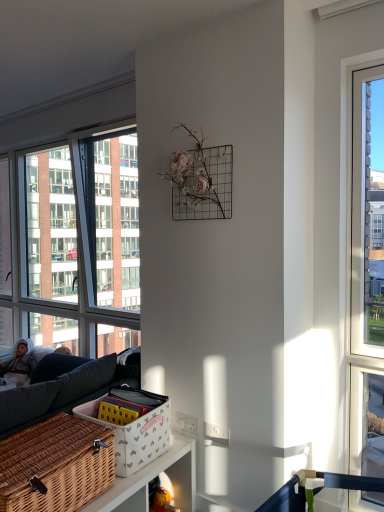
Locate an element on the screen. The image size is (384, 512). white wicker basket at lower center is located at coordinates (135, 431).

Describe the element at coordinates (135, 431) in the screenshot. I see `white wicker basket at lower center` at that location.

Measure the distance between point (66, 472) and camera.

1.56 meters.

Locate an element on the screen. This screenshot has width=384, height=512. white wicker basket at lower center is located at coordinates (135, 431).

Based on the photo, considering the sizes of objects clear glass window at left and fluffy white doll at left in the image provided, who is shorter, clear glass window at left or fluffy white doll at left?

fluffy white doll at left.

How different are the orientations of clear glass window at left and fluffy white doll at left in degrees?

The facing directions of clear glass window at left and fluffy white doll at left are 3.87 degrees apart.

Between clear glass window at left and fluffy white doll at left, which one has smaller size?

fluffy white doll at left is smaller.

Is clear glass window at left facing towards fluffy white doll at left?

Yes.

Does woven brown picnic basket at lower left have a greater height compared to clear glass window at left?

No, woven brown picnic basket at lower left is not taller than clear glass window at left.

Between woven brown picnic basket at lower left and clear glass window at left, which one has larger width?

woven brown picnic basket at lower left.

Could you tell me if white wicker basket at lower center is turned towards clear glass window at left?

No, white wicker basket at lower center is not turned towards clear glass window at left.

Visually, is white wicker basket at lower center positioned to the left or to the right of clear glass window at left?

From the image, it's evident that white wicker basket at lower center is to the right of clear glass window at left.

Which of these two, white wicker basket at lower center or clear glass window at left, stands taller?

With more height is clear glass window at left.

Is clear glass window at left located within white wicker basket at lower center?

No, clear glass window at left is located outside of white wicker basket at lower center.

Considering the sizes of woven brown picnic basket at lower left and fluffy white doll at left in the image, is woven brown picnic basket at lower left taller or shorter than fluffy white doll at left?

Clearly, woven brown picnic basket at lower left is shorter compared to fluffy white doll at left.

Considering the sizes of objects woven brown picnic basket at lower left and fluffy white doll at left in the image provided, who is bigger, woven brown picnic basket at lower left or fluffy white doll at left?

Bigger between the two is woven brown picnic basket at lower left.

From the image's perspective, is woven brown picnic basket at lower left under fluffy white doll at left?

Yes, from the image's perspective, woven brown picnic basket at lower left is below fluffy white doll at left.

What's the angular difference between woven brown picnic basket at lower left and fluffy white doll at left's facing directions?

92 degrees separate the facing orientations of woven brown picnic basket at lower left and fluffy white doll at left.

Consider the image. Is there a large distance between white wicker basket at lower center and fluffy white doll at left?

Yes, white wicker basket at lower center and fluffy white doll at left are quite far apart.

Does point (96, 419) come behind point (0, 385)?

No, (96, 419) is in front of (0, 385).

What's the angular difference between white wicker basket at lower center and fluffy white doll at left's facing directions?

91.9 degrees.

Considering the sizes of objects white wicker basket at lower center and fluffy white doll at left in the image provided, who is bigger, white wicker basket at lower center or fluffy white doll at left?

Bigger between the two is fluffy white doll at left.

Can you confirm if fluffy white doll at left is shorter than woven brown picnic basket at lower left?

In fact, fluffy white doll at left may be taller than woven brown picnic basket at lower left.

From the picture: Do you think fluffy white doll at left is within woven brown picnic basket at lower left, or outside of it?

fluffy white doll at left is not inside woven brown picnic basket at lower left, it's outside.

Who is bigger, fluffy white doll at left or woven brown picnic basket at lower left?

With larger size is woven brown picnic basket at lower left.

Is fluffy white doll at left in front of woven brown picnic basket at lower left?

No, it is behind woven brown picnic basket at lower left.

Is clear glass window at left in contact with white wicker basket at lower center?

No.

From the picture: Which object is closer to the camera taking this photo, clear glass window at left or white wicker basket at lower center?

Positioned in front is white wicker basket at lower center.

In order to click on basket below the clear glass window at left (from the image's perspective) in this screenshot , I will do `click(135, 431)`.

Find the location of `window located on the right of fluffy white doll at left`. window located on the right of fluffy white doll at left is located at coordinates (83, 238).

Find the location of `picnic basket located below the clear glass window at left (from the image's perspective)`. picnic basket located below the clear glass window at left (from the image's perspective) is located at coordinates (56, 465).

In the scene shown: Estimate the real-world distances between objects in this image. Which object is closer to fluffy white doll at left, clear glass window at left or white wicker basket at lower center?

clear glass window at left is positioned closer to the anchor fluffy white doll at left.

Based on their spatial positions, is white wicker basket at lower center or fluffy white doll at left further from clear glass window at left?

white wicker basket at lower center is further to clear glass window at left.

Estimate the real-world distances between objects in this image. Which object is further from fluffy white doll at left, white wicker basket at lower center or clear glass window at left?

white wicker basket at lower center is positioned further to the anchor fluffy white doll at left.

From the image, which object appears to be nearer to white wicker basket at lower center, woven brown picnic basket at lower left or fluffy white doll at left?

woven brown picnic basket at lower left lies closer to white wicker basket at lower center than the other object.

When comparing their distances from woven brown picnic basket at lower left, does white wicker basket at lower center or clear glass window at left seem closer?

white wicker basket at lower center is closer to woven brown picnic basket at lower left.

From the picture: Looking at the image, which one is located closer to woven brown picnic basket at lower left, clear glass window at left or fluffy white doll at left?

fluffy white doll at left is positioned closer to the anchor woven brown picnic basket at lower left.

Estimate the real-world distances between objects in this image. Which object is closer to white wicker basket at lower center, fluffy white doll at left or woven brown picnic basket at lower left?

The object closer to white wicker basket at lower center is woven brown picnic basket at lower left.

Considering their positions, is white wicker basket at lower center positioned closer to fluffy white doll at left than woven brown picnic basket at lower left?

Based on the image, white wicker basket at lower center appears to be nearer to fluffy white doll at left.

Find the location of `window located between white wicker basket at lower center and fluffy white doll at left in the depth direction`. window located between white wicker basket at lower center and fluffy white doll at left in the depth direction is located at coordinates (83, 238).

You are a GUI agent. You are given a task and a screenshot of the screen. Output one action in this format:
    pyautogui.click(x=<x>, y=<y>)
    Task: Click on the basket between woven brown picnic basket at lower left and fluffy white doll at left along the z-axis
    The height and width of the screenshot is (512, 384).
    Given the screenshot: What is the action you would take?
    pyautogui.click(x=135, y=431)

This screenshot has width=384, height=512. I want to click on window between woven brown picnic basket at lower left and fluffy white doll at left from front to back, so click(83, 238).

I want to click on basket between woven brown picnic basket at lower left and clear glass window at left in the front-back direction, so click(135, 431).